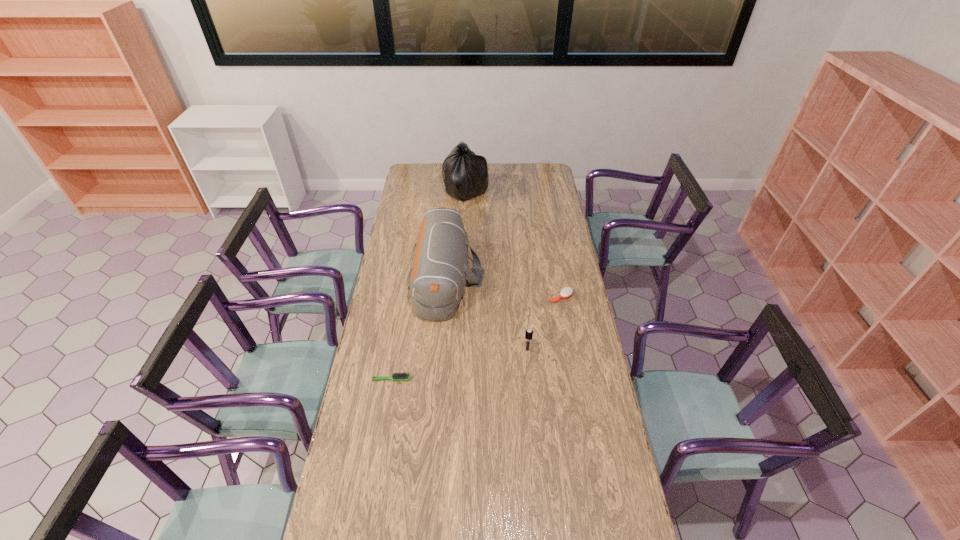
Where is `the farthest object`? The width and height of the screenshot is (960, 540). the farthest object is located at coordinates tap(465, 174).

Find the location of `plastic bag`. plastic bag is located at coordinates (465, 174).

Where is `duffel bag`? duffel bag is located at coordinates (437, 279).

Locate an element on the screen. the second hairbrush from left to right is located at coordinates (529, 332).

Where is `the second object from right to left`? This screenshot has height=540, width=960. the second object from right to left is located at coordinates (529, 332).

The height and width of the screenshot is (540, 960). What are the coordinates of `the rightmost object` in the screenshot? It's located at (566, 292).

This screenshot has width=960, height=540. I want to click on the rightmost hairbrush, so click(x=566, y=292).

I want to click on the leftmost hairbrush, so click(x=401, y=376).

At what (x,y) coordinates should I click in order to perform the action: click on the nearest hairbrush. Please return your answer as a coordinate pair (x, y). Looking at the image, I should click on (401, 376).

At what (x,y) coordinates should I click in order to perform the action: click on free space located 0.230m on the right of the farthest object. Please return your answer as a coordinate pair (x, y). Looking at the image, I should click on (527, 191).